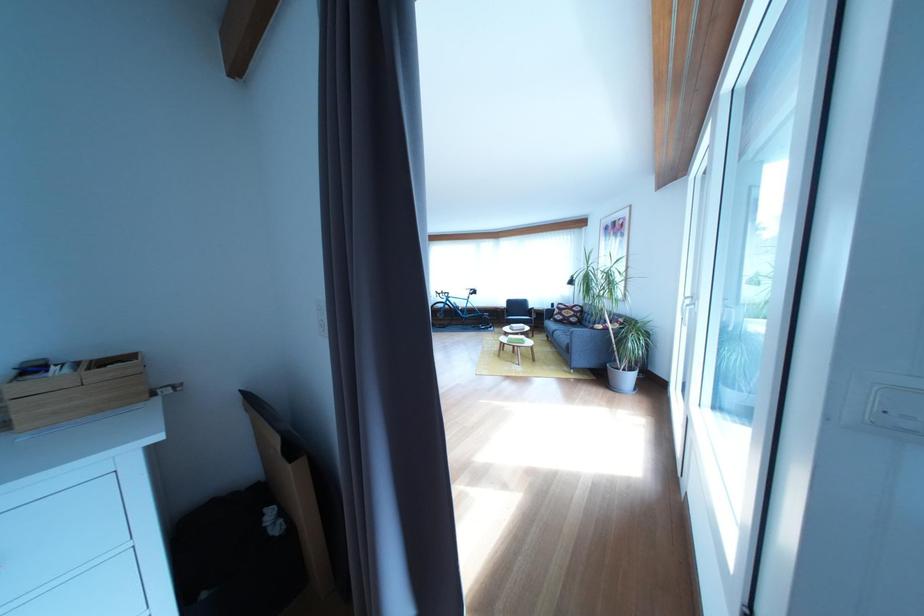
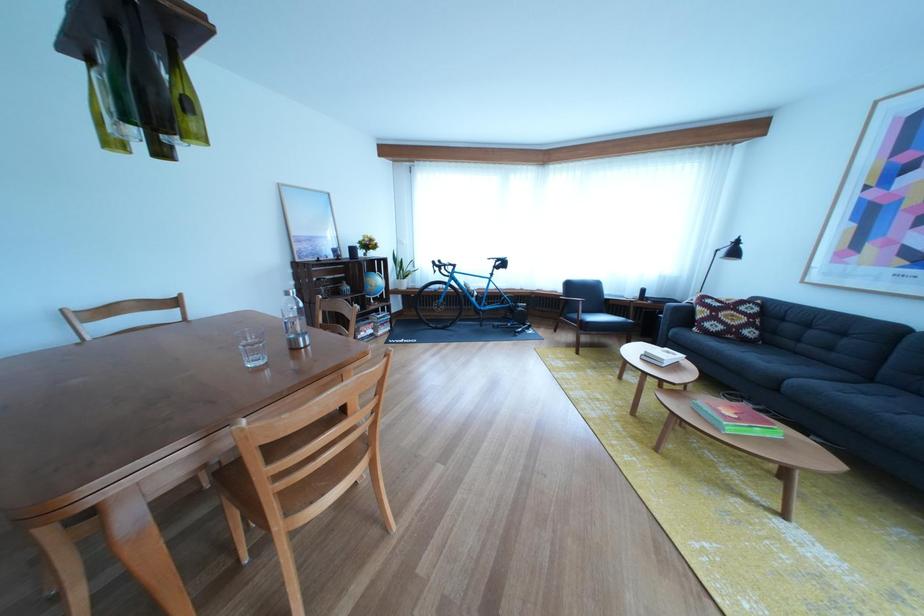
Find the pixel in the second image that matches [586,320] in the first image.

(757, 325)